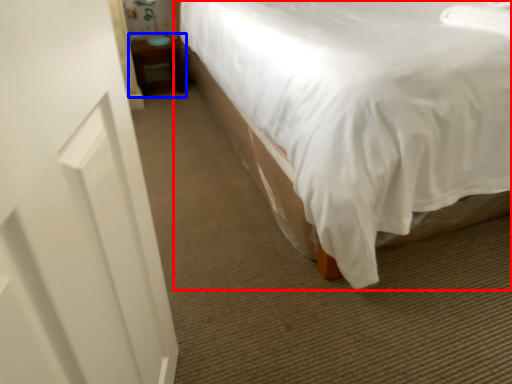
Question: Among these objects, which one is farthest to the camera, bed (highlighted by a red box) or table (highlighted by a blue box)?

Choices:
 (A) bed
 (B) table

Answer: (B)